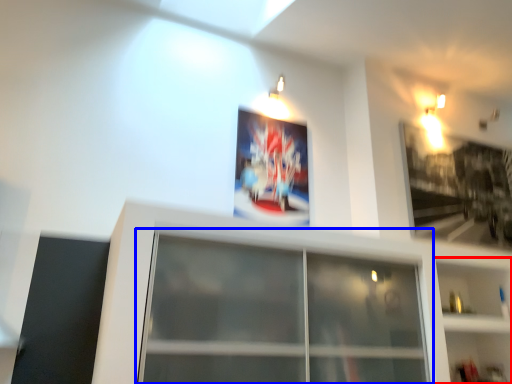
Question: Which object appears farthest to the camera in this image, shelf (highlighted by a red box) or window (highlighted by a blue box)?

Choices:
 (A) shelf
 (B) window

Answer: (A)